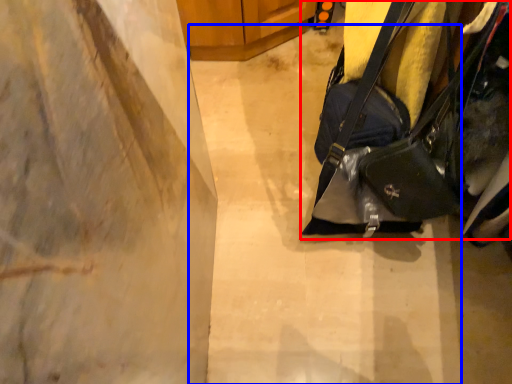
Question: Which object appears closest to the camera in this image, handbag (highlighted by a red box) or concrete (highlighted by a blue box)?

Choices:
 (A) handbag
 (B) concrete

Answer: (A)